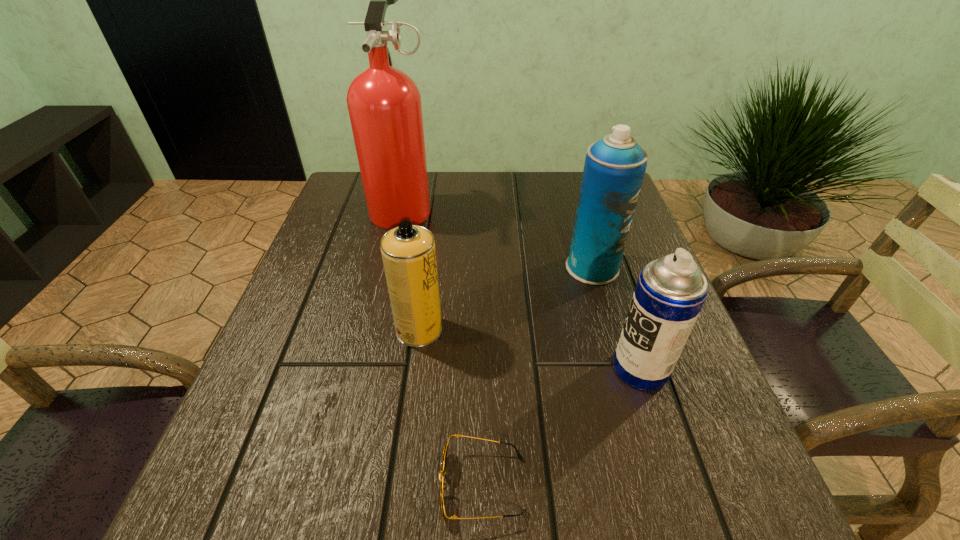
Locate which aerosol can is the closest to the sunglasses. Please provide its 2D coordinates. Your answer should be formatted as a tuple, i.e. [(x, y)], where the tuple contains the x and y coordinates of a point satisfying the conditions above.

[(408, 251)]

Find the location of a particular element. aerosol can that can be found as the second closest to the tallest object is located at coordinates (614, 168).